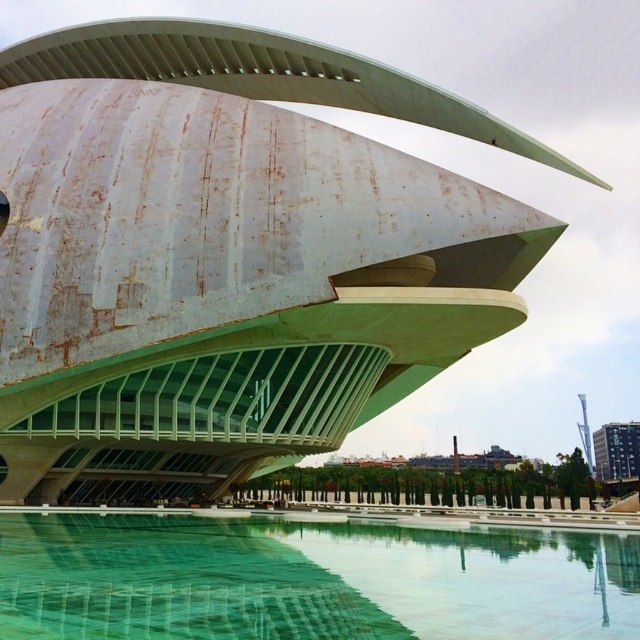
You are a drone operator tasked with capturing aerial footage of the white matte building at center and the green mosaic tiles at lower center. The drone has a maximum flight radius of 20 meters. Can the drone safely capture both objects without exceeding its operational limit?

The white matte building at center and green mosaic tiles at lower center are 17.62 meters apart from each other. Since the distance between them is within the drone operator maximum flight radius of 20 meters, the drone can safely capture both objects without exceeding its operational limit.

You are standing in front of the building and want to locate the point at coordinate (228, 253). Based on the scene description, where exactly on the building would this point be located?

The point at coordinate (228, 253) is on the white matte building at center.